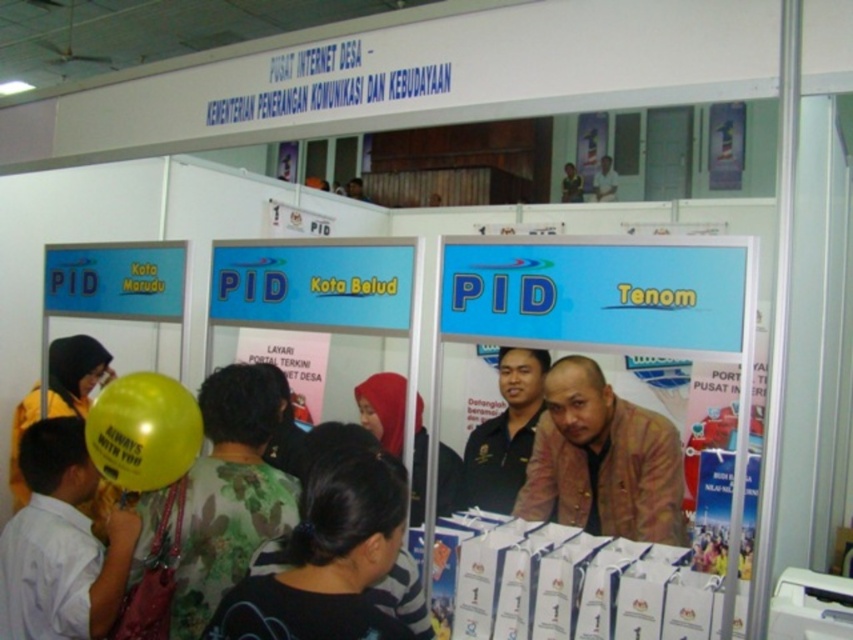
Question: Does black shirt at center appear on the left side of yellow matte balloon at lower left?

Choices:
 (A) no
 (B) yes

Answer: (A)

Question: Which of the following is the closest to the observer?

Choices:
 (A) black matte shirt at center
 (B) yellow rubber balloon at lower left
 (C) black shirt at center
 (D) brown leather jacket at lower right

Answer: (A)

Question: Which object appears farthest from the camera in this image?

Choices:
 (A) black shirt at center
 (B) matte black shirt at center
 (C) yellow matte balloon at left

Answer: (A)

Question: Can you confirm if yellow matte balloon at left is positioned to the left of yellow matte balloon at lower left?

Choices:
 (A) yes
 (B) no

Answer: (B)

Question: Can you confirm if yellow rubber balloon at lower left is positioned above yellow matte balloon at lower left?

Choices:
 (A) no
 (B) yes

Answer: (A)

Question: Among these objects, which one is nearest to the camera?

Choices:
 (A) yellow matte balloon at lower left
 (B) brown leather jacket at lower right
 (C) light brown leather jacket at upper center
 (D) yellow matte balloon at left

Answer: (D)